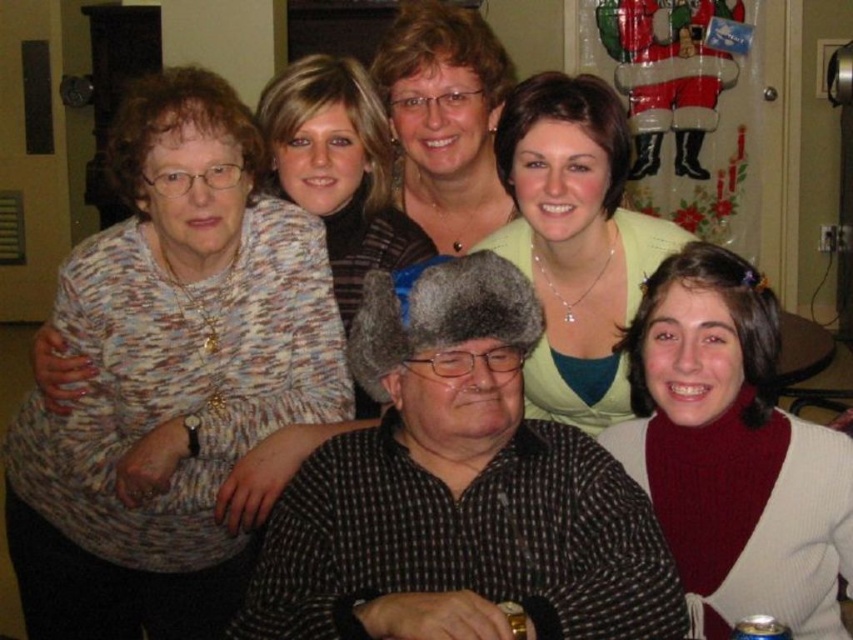
Does checkered fabric shirt at center have a greater width compared to knitted red sweater at lower right?

Indeed, checkered fabric shirt at center has a greater width compared to knitted red sweater at lower right.

Which is in front, point (548, 618) or point (677, 554)?

Point (548, 618) is in front.

Is point (534, 532) positioned after point (674, 522)?

No, it is in front of (674, 522).

This screenshot has height=640, width=853. I want to click on checkered fabric shirt at center, so click(x=457, y=493).

What do you see at coordinates (457, 493) in the screenshot? The height and width of the screenshot is (640, 853). I see `checkered fabric shirt at center` at bounding box center [457, 493].

Can you confirm if checkered fabric shirt at center is positioned to the right of knitted sweater at upper center?

Yes, checkered fabric shirt at center is to the right of knitted sweater at upper center.

The image size is (853, 640). What do you see at coordinates (457, 493) in the screenshot?
I see `checkered fabric shirt at center` at bounding box center [457, 493].

This screenshot has width=853, height=640. What are the coordinates of `checkered fabric shirt at center` in the screenshot? It's located at (457, 493).

Is point (19, 508) more distant than point (518, 189)?

Yes.

Consider the image. Who is taller, speckled knit sweater at upper left or light green fabric shirt at center?

With more height is speckled knit sweater at upper left.

Between point (318, 228) and point (577, 195), which one is positioned behind?

Positioned behind is point (318, 228).

In order to click on speckled knit sweater at upper left in this screenshot , I will do `click(169, 374)`.